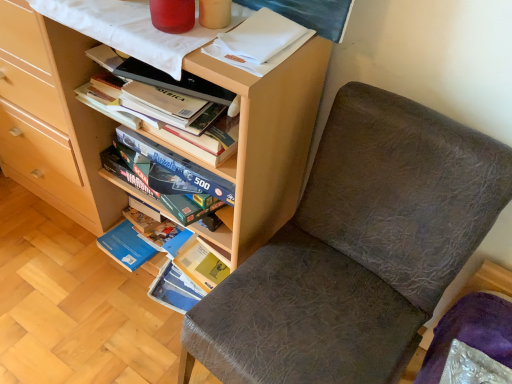
Question: From a real-world perspective, is matte wood bookcase at center positioned above or below brown leather chair at center?

Choices:
 (A) below
 (B) above

Answer: (B)

Question: In terms of width, does matte wood bookcase at center look wider or thinner when compared to brown leather chair at center?

Choices:
 (A) wide
 (B) thin

Answer: (B)

Question: In terms of height, does matte wood bookcase at center look taller or shorter compared to brown leather chair at center?

Choices:
 (A) short
 (B) tall

Answer: (B)

Question: From a real-world perspective, is brown leather chair at center above or below matte wood bookcase at center?

Choices:
 (A) below
 (B) above

Answer: (A)

Question: Is brown leather chair at center inside the boundaries of matte wood bookcase at center, or outside?

Choices:
 (A) inside
 (B) outside

Answer: (B)

Question: From the image's perspective, relative to matte wood bookcase at center, is brown leather chair at center above or below?

Choices:
 (A) above
 (B) below

Answer: (B)

Question: Based on their positions, is brown leather chair at center located to the left or right of matte wood bookcase at center?

Choices:
 (A) right
 (B) left

Answer: (A)